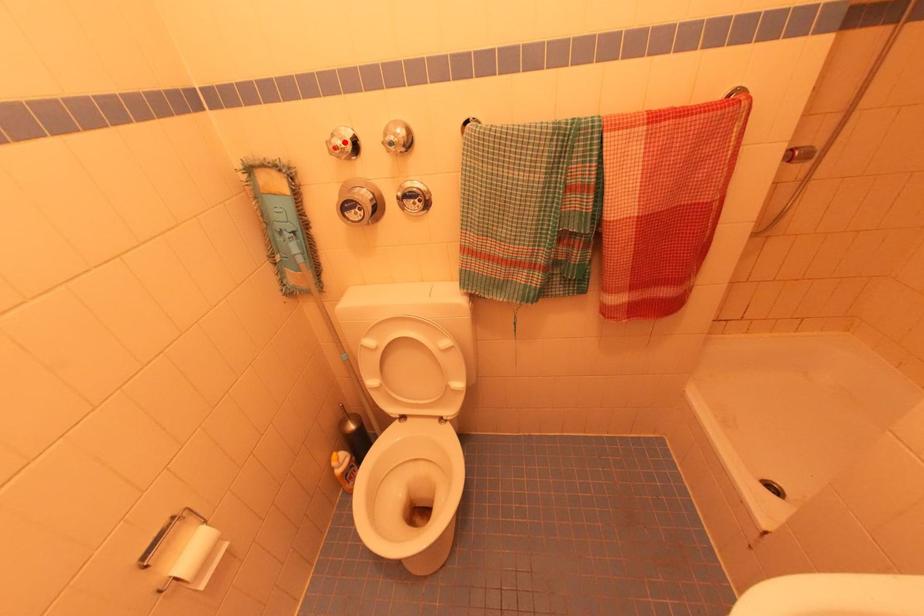
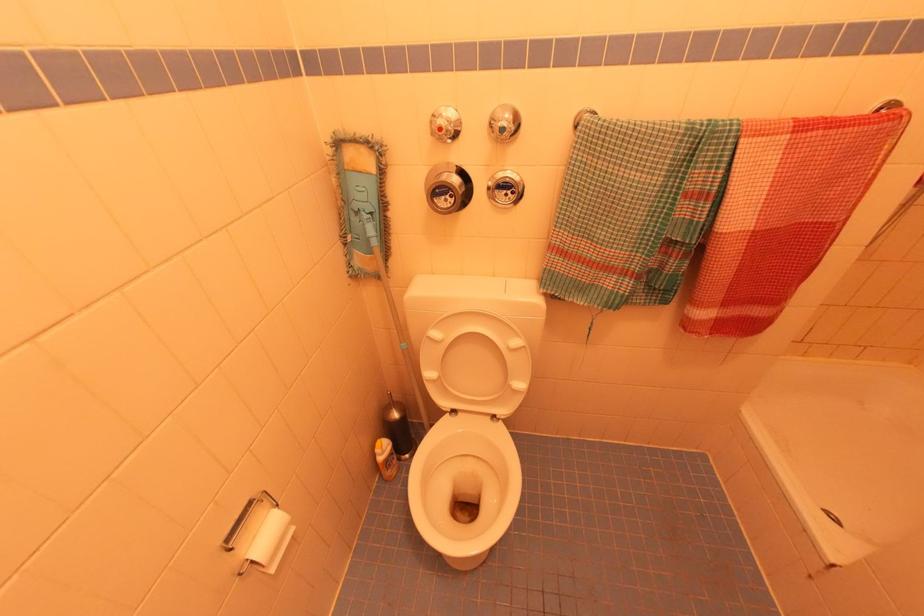
The point at the highlighted location is marked in the first image. Where is the corresponding point in the second image?

(450, 123)